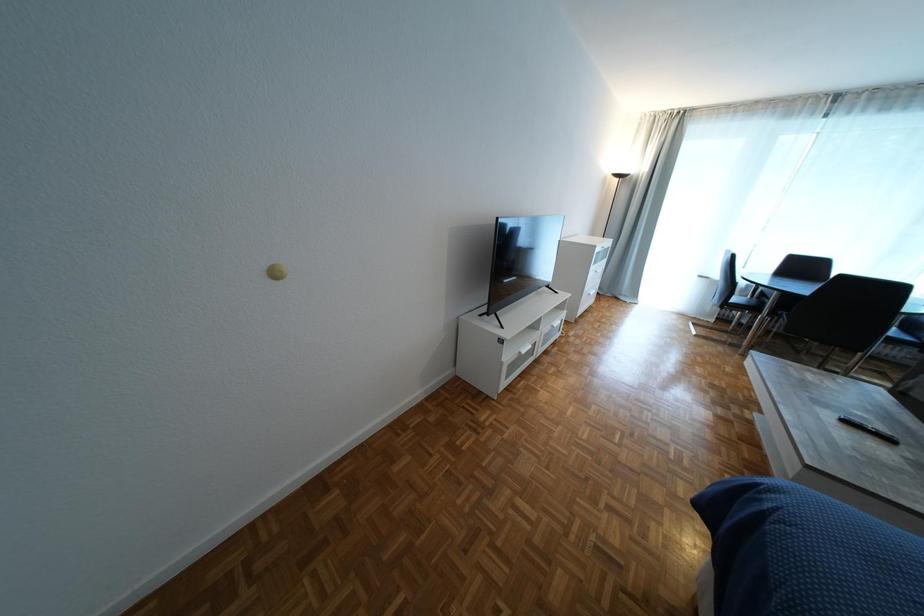
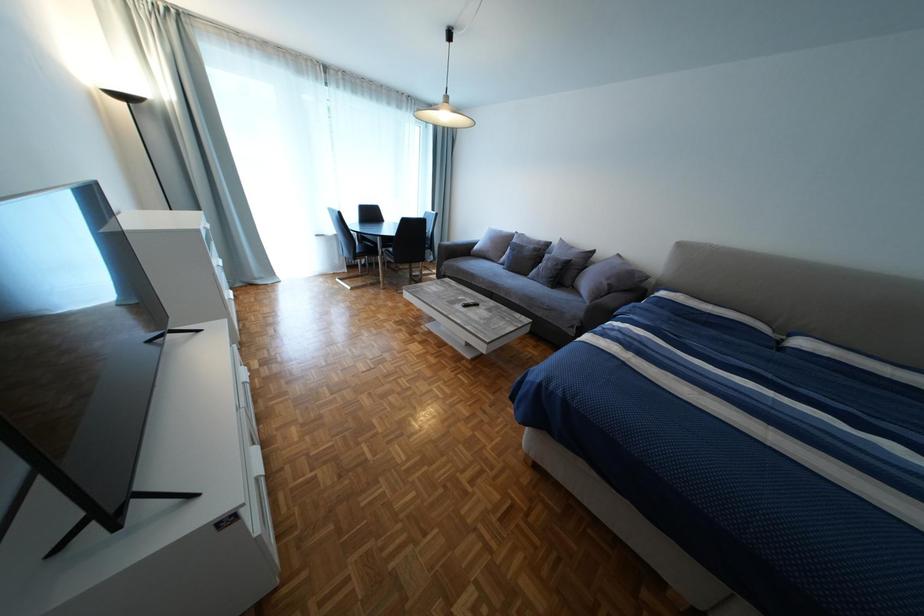
The first image is from the beginning of the video and the second image is from the end. How did the camera likely rotate when shooting the video?

The camera's rotation is toward right-down.